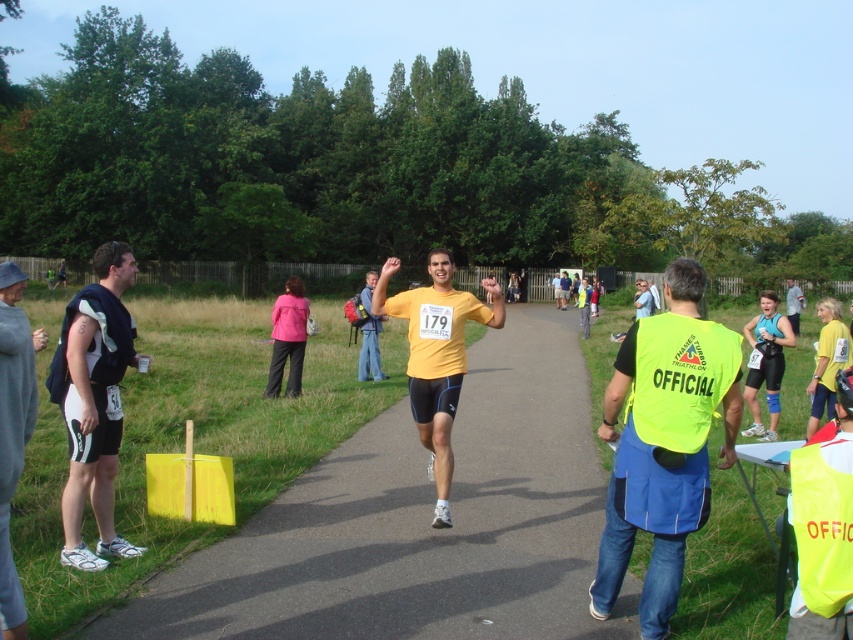
From the picture: Which is above, yellow fabric runner at center or yellow matte triathlon suit at center?

yellow matte triathlon suit at center

Is yellow fabric runner at center positioned in front of yellow matte triathlon suit at center?

Yes.

Is point (560, 547) farther from viewer compared to point (364, 291)?

No, it is not.

Image resolution: width=853 pixels, height=640 pixels. What are the coordinates of `yellow fabric runner at center` in the screenshot? It's located at [x=421, y=522].

Is neon yellow vest at right shorter than gray sweatshirt at left?

Incorrect, neon yellow vest at right's height does not fall short of gray sweatshirt at left's.

Which is behind, point (613, 529) or point (16, 451)?

The point (613, 529) is more distant.

Who is more distant from viewer, [660,369] or [7,573]?

Positioned behind is point [660,369].

The image size is (853, 640). In order to click on neon yellow vest at right in this screenshot , I will do `click(663, 448)`.

Who is more forward, (633, 412) or (439, 465)?

Point (633, 412) is in front.

Who is more distant from viewer, (x=660, y=602) or (x=445, y=424)?

The point (x=445, y=424) is more distant.

At what (x,y) coordinates should I click in order to perform the action: click on neon yellow vest at right. Please return your answer as a coordinate pair (x, y). Image resolution: width=853 pixels, height=640 pixels. Looking at the image, I should click on click(663, 448).